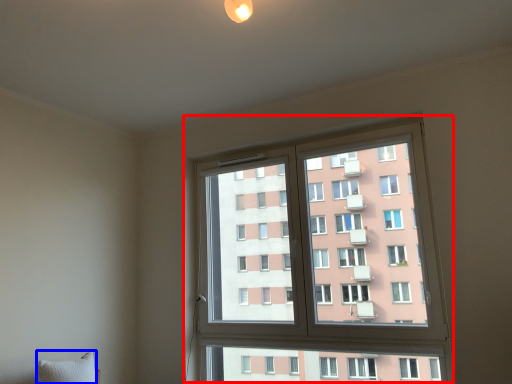
Question: Which object is closer to the camera taking this photo, window (highlighted by a red box) or pillow (highlighted by a blue box)?

Choices:
 (A) window
 (B) pillow

Answer: (B)